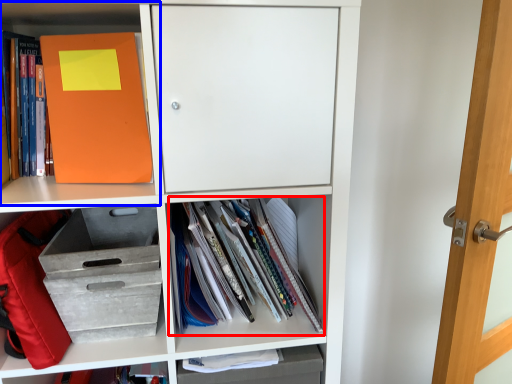
Question: Which object is further to the camera taking this photo, book (highlighted by a red box) or shelf (highlighted by a blue box)?

Choices:
 (A) book
 (B) shelf

Answer: (A)